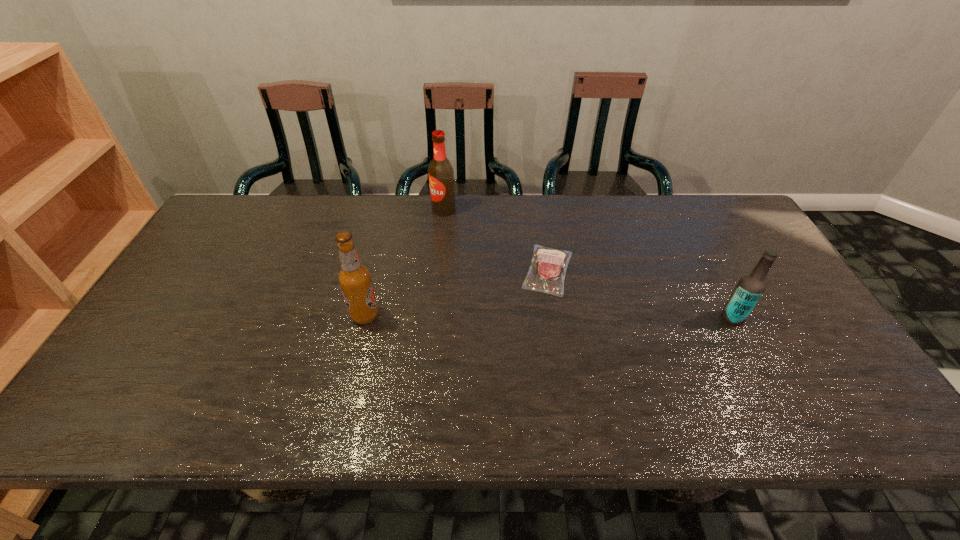
Identify the location of the second object from left to right. Image resolution: width=960 pixels, height=540 pixels. (440, 171).

Identify the location of the farthest object. The width and height of the screenshot is (960, 540). (440, 171).

Where is `the leftmost beer bottle`? This screenshot has height=540, width=960. the leftmost beer bottle is located at coordinates (354, 278).

Image resolution: width=960 pixels, height=540 pixels. Find the location of `the rightmost object`. the rightmost object is located at coordinates (751, 286).

Where is `the rightmost beer bottle`? the rightmost beer bottle is located at coordinates (751, 286).

Identify the location of the shortest object. (546, 274).

You are a GUI agent. You are given a task and a screenshot of the screen. Output one action in this format:
    pyautogui.click(x=<x>, y=<y>)
    Task: Click on the third nearest object
    
    Given the screenshot: What is the action you would take?
    pyautogui.click(x=546, y=274)

The height and width of the screenshot is (540, 960). I want to click on free region located 0.210m on the left of the second object from left to right, so click(x=370, y=210).

This screenshot has height=540, width=960. Find the location of `blank area located on the front label of the leftmost object`. blank area located on the front label of the leftmost object is located at coordinates (433, 315).

Where is `free space located 0.210m on the label of the rightmost beer bottle`? free space located 0.210m on the label of the rightmost beer bottle is located at coordinates (641, 318).